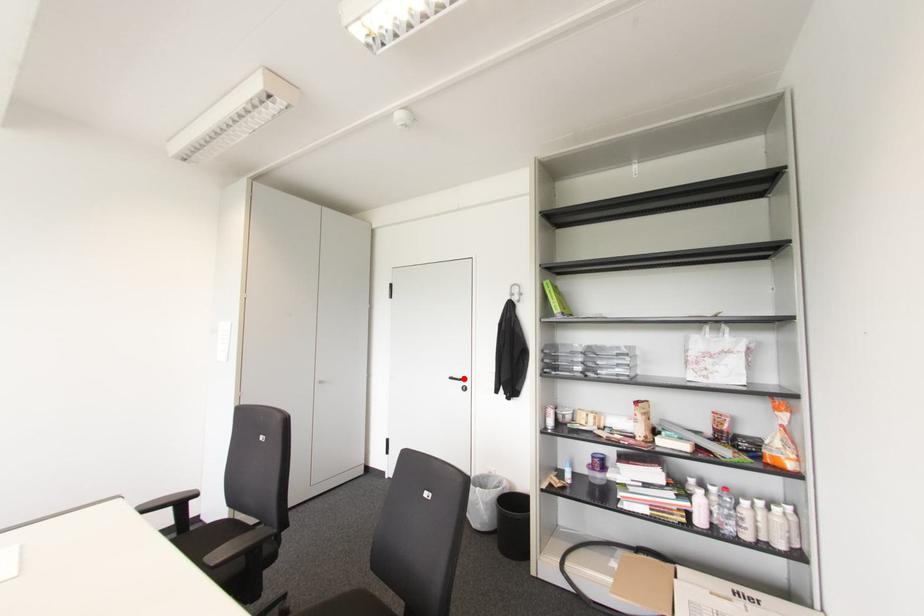
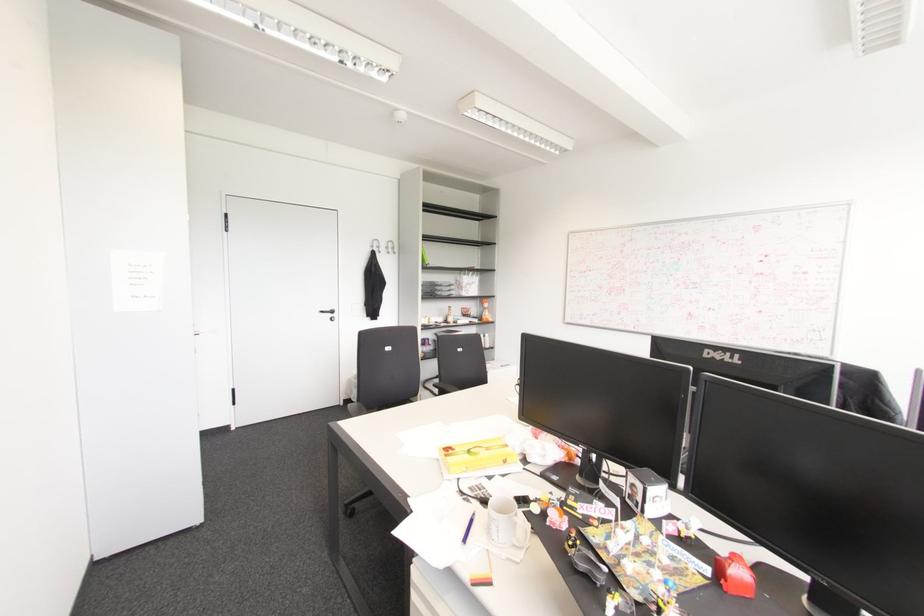
The point at the highlighted location is marked in the first image. Where is the corresponding point in the second image?

(332, 310)